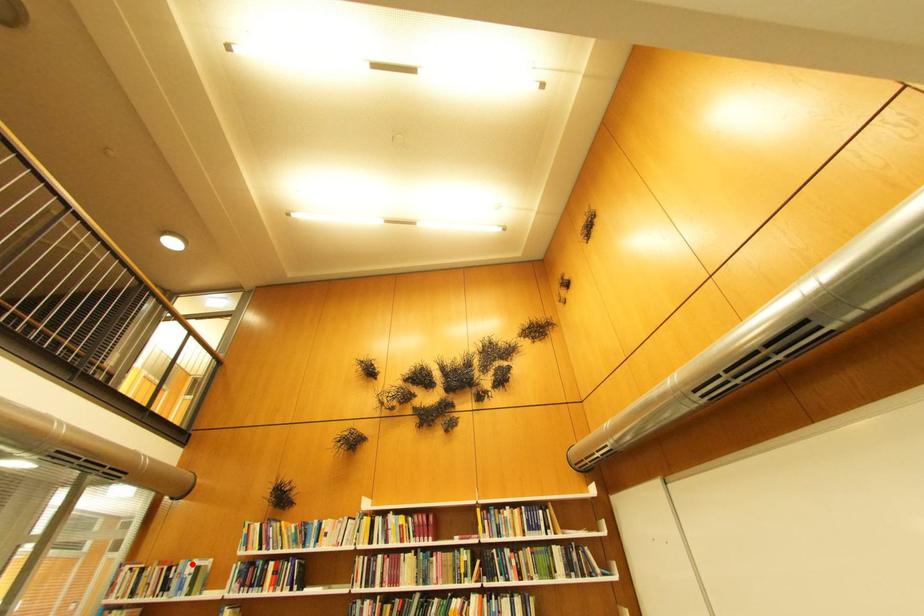
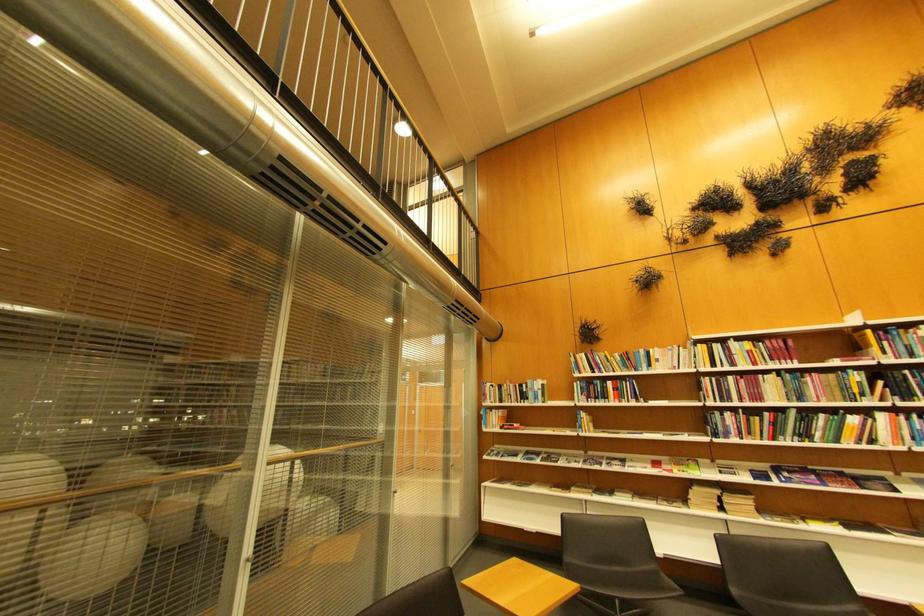
Question: I am providing you with two images of the same scene from different viewpoints. In image1, a red point is highlighted. Considering the same 3D point in image2, which of the following is correct?

Choices:
 (A) It is closer
 (B) It is farther

Answer: (B)